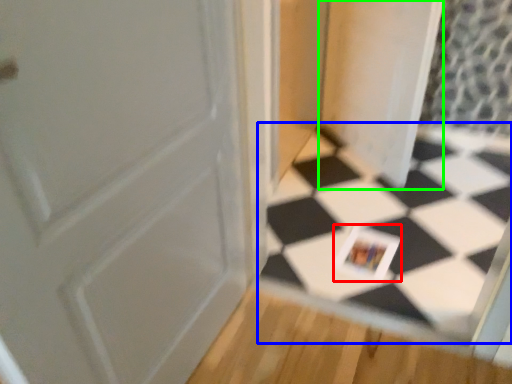
Question: Which object is the farthest from postcard (highlighted by a red box)? Choose among these: square (highlighted by a blue box) or screen door (highlighted by a green box).

Choices:
 (A) square
 (B) screen door

Answer: (B)